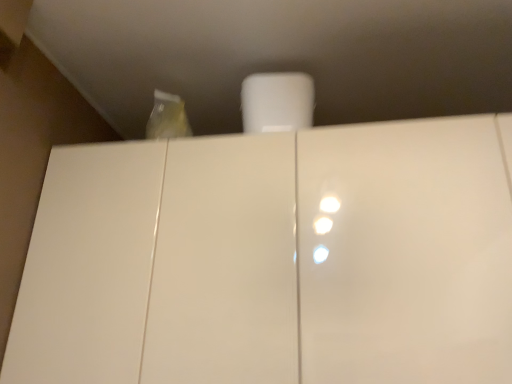
What do you see at coordinates (273, 260) in the screenshot? I see `glossy white cabinet at center` at bounding box center [273, 260].

Where is `glossy white cabinet at center`? This screenshot has width=512, height=384. glossy white cabinet at center is located at coordinates (273, 260).

Find the location of `glossy white cabinet at center`. glossy white cabinet at center is located at coordinates (273, 260).